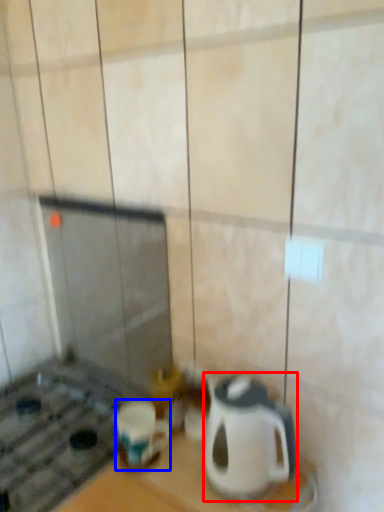
Question: Among these objects, which one is nearest to the camera, kitchen appliance (highlighted by a red box) or coffee cup (highlighted by a blue box)?

Choices:
 (A) kitchen appliance
 (B) coffee cup

Answer: (A)